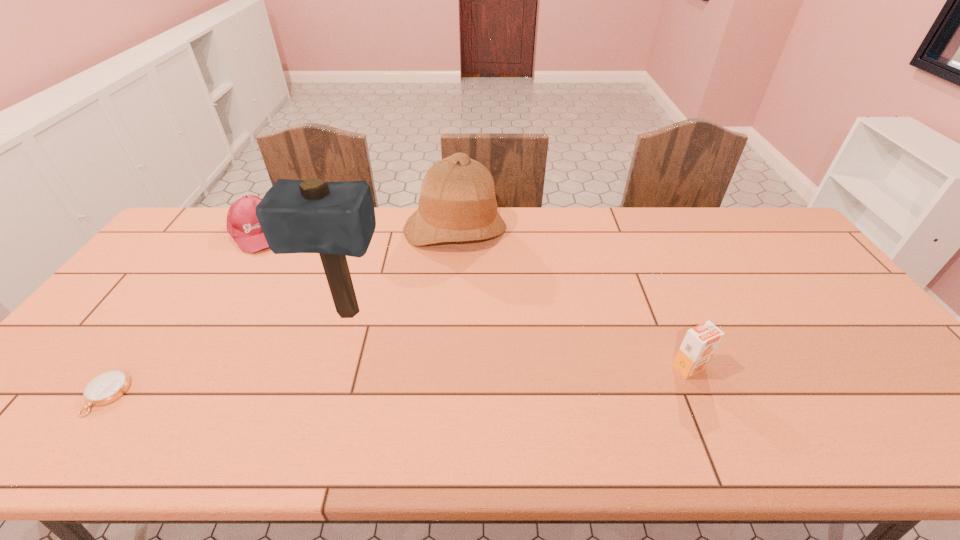
I want to click on vacant position located 0.300m on the front-facing side of the hat, so click(461, 325).

In order to click on vacant space situated on the front-facing side of the hat in this screenshot , I will do `click(459, 292)`.

Where is `free region located 0.170m on the striking surface of the mallet`? free region located 0.170m on the striking surface of the mallet is located at coordinates [x=319, y=387].

This screenshot has height=540, width=960. What are the coordinates of `vacant space situated on the striking surface of the mallet` in the screenshot? It's located at (324, 373).

Find the location of a particular element. free space located on the striking surface of the mallet is located at coordinates (324, 373).

This screenshot has width=960, height=540. I want to click on free space located at the front of the baseball cap with the brim, so click(269, 263).

This screenshot has width=960, height=540. Find the location of `free space located at the front of the baseball cap with the brim`. free space located at the front of the baseball cap with the brim is located at coordinates (290, 309).

Image resolution: width=960 pixels, height=540 pixels. Find the location of `free location located 0.270m at the front of the baseball cap with the brim`. free location located 0.270m at the front of the baseball cap with the brim is located at coordinates (286, 301).

Locate an element on the screen. The width and height of the screenshot is (960, 540). hat that is at the far edge is located at coordinates (457, 203).

Where is `baseball cap that is at the far edge`? Image resolution: width=960 pixels, height=540 pixels. baseball cap that is at the far edge is located at coordinates (242, 223).